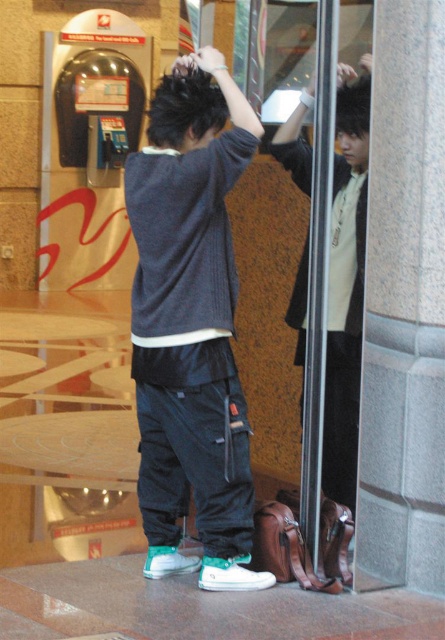
Can you confirm if dark gray sweater at center is shorter than matte black jacket at center?

No.

Can you confirm if dark gray sweater at center is positioned to the right of matte black jacket at center?

Incorrect, dark gray sweater at center is not on the right side of matte black jacket at center.

Does point (173, 355) lie in front of point (335, 154)?

Yes, it is in front of point (335, 154).

Identify the location of dark gray sweater at center. (191, 324).